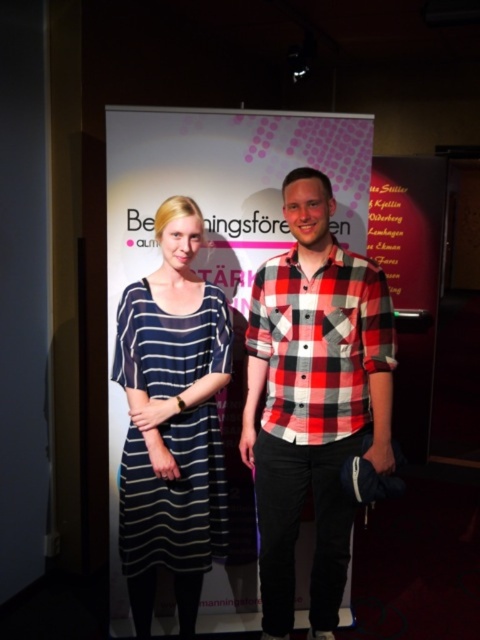
In the scene shown: You are organizing a clothing store and need to arrange these two shirts, the red plaid shirt at center and the red checkered shirt at center, on a hanger rack. Since they are both red, you want to place them next to each other. However, due to limited space, you can only place one in front. Which shirt should you place in front based on their current positions in the image?

The red plaid shirt at center is already in front of the red checkered shirt at center in the image, so you should keep the red plaid shirt at center in front to maintain their arrangement.

You are a photographer setting up for a group photo. You notice the red plaid shirt at center and the navy striped dress at center. Which clothing item should you position closer to the back to ensure both are fully visible in the photo?

The red plaid shirt at center is much taller than the navy striped dress at center, so you should position the red plaid shirt at center closer to the back to ensure both are fully visible in the photo.